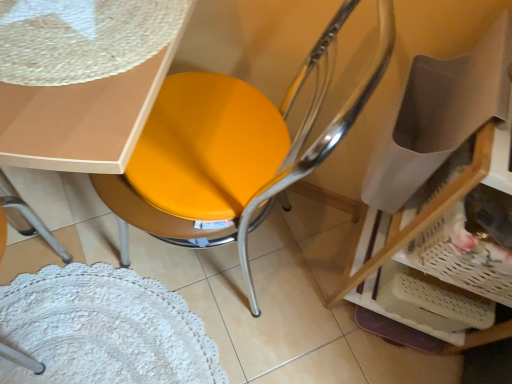
What do you see at coordinates (234, 147) in the screenshot? The width and height of the screenshot is (512, 384). I see `matte yellow seat at center` at bounding box center [234, 147].

Measure the distance between white woven basket at lower right and camera.

white woven basket at lower right and camera are 25.67 inches apart from each other.

The image size is (512, 384). Describe the element at coordinates (82, 79) in the screenshot. I see `matte white table at upper left` at that location.

The width and height of the screenshot is (512, 384). I want to click on matte yellow seat at center, so click(x=234, y=147).

Is matte white table at upper left at the back of matte yellow seat at center?

No, matte yellow seat at center's orientation is not away from matte white table at upper left.

From the image's perspective, between matte yellow seat at center and matte white table at upper left, who is located below?

matte yellow seat at center is shown below in the image.

Considering the sizes of matte yellow seat at center and matte white table at upper left in the image, is matte yellow seat at center wider or thinner than matte white table at upper left?

In the image, matte yellow seat at center appears to be wider than matte white table at upper left.

Based on the photo, is matte white table at upper left behind matte yellow seat at center?

Yes, matte white table at upper left is behind matte yellow seat at center.

Which is closer, (45, 154) or (186, 159)?

The point (45, 154) is closer to the camera.

Looking at this image, can you confirm if matte white table at upper left is thinner than matte yellow seat at center?

Yes.

Considering the relative positions of matte white table at upper left and matte yellow seat at center in the image provided, is matte white table at upper left to the left or to the right of matte yellow seat at center?

Clearly, matte white table at upper left is on the left of matte yellow seat at center in the image.

How distant is matte white table at upper left from white woven basket at lower right?

matte white table at upper left and white woven basket at lower right are 23.27 inches apart.

From the image's perspective, is matte white table at upper left under white woven basket at lower right?

No.

Which is farther, (52, 77) or (508, 261)?

The point (508, 261) is farther from the camera.

Considering the positions of objects matte white table at upper left and white woven basket at lower right in the image provided, who is more to the left, matte white table at upper left or white woven basket at lower right?

From the viewer's perspective, matte white table at upper left appears more on the left side.

What's the angular difference between matte yellow seat at center and white woven basket at lower right's facing directions?

The angle between the facing direction of matte yellow seat at center and the facing direction of white woven basket at lower right is 91.3 degrees.

Does matte yellow seat at center have a smaller size compared to white woven basket at lower right?

No.

From a real-world perspective, which is physically below, matte yellow seat at center or white woven basket at lower right?

In real-world perspective, matte yellow seat at center is lower.

Is white woven basket at lower right next to matte yellow seat at center?

There is a gap between white woven basket at lower right and matte yellow seat at center.

Does point (486, 277) lie behind point (198, 169)?

No, it is not.

Which is in front, white woven basket at lower right or matte yellow seat at center?

matte yellow seat at center.

From a real-world perspective, is white woven basket at lower right located higher than matte yellow seat at center?

Yes, from a real-world perspective, white woven basket at lower right is on top of matte yellow seat at center.

Which is behind, white woven basket at lower right or matte white table at upper left?

white woven basket at lower right is further away from the camera.

From the image's perspective, which object appears higher, white woven basket at lower right or matte white table at upper left?

From the image's view, matte white table at upper left is above.

Consider the image. Is white woven basket at lower right positioned far away from matte white table at upper left?

Actually, white woven basket at lower right and matte white table at upper left are a little close together.

Is white woven basket at lower right turned away from matte white table at upper left?

white woven basket at lower right does not have its back to matte white table at upper left.

Identify the location of table positioned vertically above the matte yellow seat at center (from a real-world perspective). tap(82, 79).

Where is `table lying behind the matte yellow seat at center`? This screenshot has width=512, height=384. table lying behind the matte yellow seat at center is located at coordinates (82, 79).

Estimate the real-world distances between objects in this image. Which object is further from white woven basket at lower right, matte yellow seat at center or matte white table at upper left?

Based on the image, matte white table at upper left appears to be further to white woven basket at lower right.

Which object lies nearer to the anchor point matte yellow seat at center, matte white table at upper left or white woven basket at lower right?

Among the two, matte white table at upper left is located nearer to matte yellow seat at center.

Which object lies nearer to the anchor point white woven basket at lower right, matte white table at upper left or matte yellow seat at center?

matte yellow seat at center.

Which object lies further to the anchor point matte white table at upper left, white woven basket at lower right or matte yellow seat at center?

white woven basket at lower right is further to matte white table at upper left.

When comparing their distances from matte white table at upper left, does matte yellow seat at center or white woven basket at lower right seem closer?

matte yellow seat at center.

Which object lies further to the anchor point matte yellow seat at center, white woven basket at lower right or matte white table at upper left?

white woven basket at lower right lies further to matte yellow seat at center than the other object.

Where is `chair located between matte white table at upper left and white woven basket at lower right in the left-right direction`? The width and height of the screenshot is (512, 384). chair located between matte white table at upper left and white woven basket at lower right in the left-right direction is located at coordinates (234, 147).